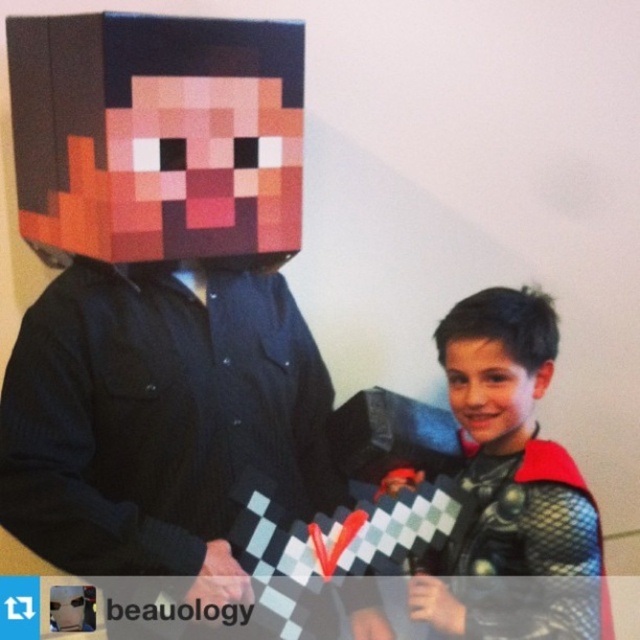
Based on the coordinates provided, where is the dark brown hair at center located in the image?

The dark brown hair at center is located at the coordinates point (497, 364).

You are a photographer at a cosplay event and need to position the matte black costume at center and the smooth skin face at center correctly. According to the scene, which object is positioned to the right of the other?

The matte black costume at center is positioned to the right of the smooth skin face at center.

You are standing in front of the Minecraft costume display. There are two points marked on the image. The first point is at coordinates point (x=499, y=337), and the second is at point (x=449, y=371). Which point is closer to you?

Point (x=499, y=337) is closer to the viewer than point (x=449, y=371).